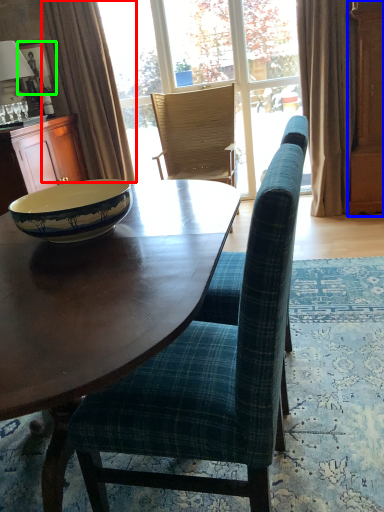
Question: Which object is the farthest from curtain (highlighted by a red box)? Choose among these: screen door (highlighted by a blue box) or picture frame (highlighted by a green box).

Choices:
 (A) screen door
 (B) picture frame

Answer: (A)